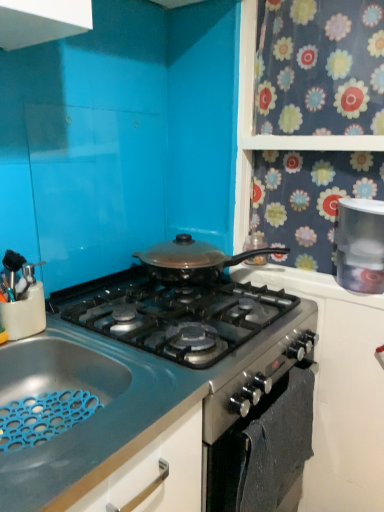
Measure the distance between point (x=285, y=455) and camera.

The distance of point (x=285, y=455) from camera is 1.17 meters.

Describe the element at coordinates (158, 398) in the screenshot. I see `satin black pan at center` at that location.

Describe the element at coordinates (360, 245) in the screenshot. I see `white plastic container at upper right` at that location.

What is the approximate height of white plastic container at upper right?

It is 10.28 inches.

At what (x,y) coordinates should I click in order to perform the action: click on satin silver oven at lower center. Please return your answer as a coordinate pair (x, y). The height and width of the screenshot is (512, 384). Looking at the image, I should click on (263, 450).

Does satin silver oven at lower center have a lesser height compared to satin black pan at center?

No.

How distant is satin silver oven at lower center from satin black pan at center?

They are 6.38 inches apart.

In the scene shown: Is satin silver oven at lower center far from satin black pan at center?

Actually, satin silver oven at lower center and satin black pan at center are a little close together.

Is satin black pan at center completely or partially inside satin silver oven at lower center?

No, satin black pan at center is located outside of satin silver oven at lower center.

From the picture: Is white plastic container at upper right at the back of blue rubber mat at lower left?

No.

Image resolution: width=384 pixels, height=512 pixels. Find the location of `sink lying in front of the white plastic container at upper right`. sink lying in front of the white plastic container at upper right is located at coordinates (74, 389).

Which is in front, point (76, 352) or point (352, 214)?

The point (76, 352) is closer.

Is blue rubber mat at lower left taller or shorter than white plastic container at upper right?

blue rubber mat at lower left is shorter than white plastic container at upper right.

Is white plastic container at upper right looking in the opposite direction of blue rubber mat at lower left?

No, white plastic container at upper right is not facing away from blue rubber mat at lower left.

How much distance is there between white plastic container at upper right and blue rubber mat at lower left?

white plastic container at upper right is 29.92 inches from blue rubber mat at lower left.

Can you confirm if white plastic container at upper right is taller than blue rubber mat at lower left?

Correct, white plastic container at upper right is much taller as blue rubber mat at lower left.

Is white plastic container at upper right inside the boundaries of blue rubber mat at lower left, or outside?

Answer: white plastic container at upper right is not inside blue rubber mat at lower left, it's outside.

From the image's perspective, would you say white plastic container at upper right is positioned over satin silver oven at lower center?

Yes, from the image's perspective, white plastic container at upper right is on top of satin silver oven at lower center.

Which object is positioned more to the right, white plastic container at upper right or satin silver oven at lower center?

Positioned to the right is white plastic container at upper right.

From a real-world perspective, who is located lower, white plastic container at upper right or satin silver oven at lower center?

From a 3D spatial view, satin silver oven at lower center is below.

Is white plastic container at upper right shorter than satin silver oven at lower center?

Indeed, white plastic container at upper right has a lesser height compared to satin silver oven at lower center.

Which is more to the right, satin black pan at center or white plastic container at upper right?

Positioned to the right is white plastic container at upper right.

Is satin black pan at center thinner than white plastic container at upper right?

No.

Where is `gas stove in front of the white plastic container at upper right`? Image resolution: width=384 pixels, height=512 pixels. gas stove in front of the white plastic container at upper right is located at coordinates (158, 398).

Measure the distance between satin black pan at center and white plastic container at upper right.

A distance of 20.87 inches exists between satin black pan at center and white plastic container at upper right.

Is satin black pan at center next to blue rubber mat at lower left and touching it?

No, satin black pan at center is not next to blue rubber mat at lower left.

Would you say satin black pan at center is to the left or to the right of blue rubber mat at lower left in the picture?

satin black pan at center is positioned on blue rubber mat at lower left's right side.

From the image's perspective, between satin black pan at center and blue rubber mat at lower left, who is located below?

blue rubber mat at lower left.

Considering the positions of objects satin black pan at center and blue rubber mat at lower left in the image provided, who is in front, satin black pan at center or blue rubber mat at lower left?

blue rubber mat at lower left.

Is blue rubber mat at lower left not within satin black pan at center?

Yes, blue rubber mat at lower left is outside of satin black pan at center.

Which object is closer to the camera taking this photo, blue rubber mat at lower left or satin black pan at center?

blue rubber mat at lower left is in front.

What's the angular difference between blue rubber mat at lower left and satin black pan at center's facing directions?

The facing directions of blue rubber mat at lower left and satin black pan at center are 0.236 degrees apart.

Is blue rubber mat at lower left far from satin black pan at center?

Actually, blue rubber mat at lower left and satin black pan at center are a little close together.

Image resolution: width=384 pixels, height=512 pixels. In order to click on oven located below the satin black pan at center (from the image's perspective) in this screenshot , I will do `click(263, 450)`.

This screenshot has height=512, width=384. Find the location of `kitchen appliance that appears above the blue rubber mat at lower left (from the image's perspective)`. kitchen appliance that appears above the blue rubber mat at lower left (from the image's perspective) is located at coordinates (360, 245).

Considering their positions, is satin silver oven at lower center positioned closer to blue rubber mat at lower left than white plastic container at upper right?

Based on the image, satin silver oven at lower center appears to be nearer to blue rubber mat at lower left.

Which object lies further to the anchor point satin silver oven at lower center, blue rubber mat at lower left or white plastic container at upper right?

The object further to satin silver oven at lower center is white plastic container at upper right.

Considering their positions, is satin black pan at center positioned further to satin silver oven at lower center than white plastic container at upper right?

The object further to satin silver oven at lower center is white plastic container at upper right.

Considering their positions, is blue rubber mat at lower left positioned closer to white plastic container at upper right than satin black pan at center?

Based on the image, satin black pan at center appears to be nearer to white plastic container at upper right.

Looking at the image, which one is located closer to satin black pan at center, satin silver oven at lower center or blue rubber mat at lower left?

Based on the image, satin silver oven at lower center appears to be nearer to satin black pan at center.

Considering their positions, is white plastic container at upper right positioned further to blue rubber mat at lower left than satin silver oven at lower center?

The object further to blue rubber mat at lower left is white plastic container at upper right.

Which object lies nearer to the anchor point satin black pan at center, white plastic container at upper right or blue rubber mat at lower left?

The object closer to satin black pan at center is blue rubber mat at lower left.

From the image, which object appears to be nearer to satin silver oven at lower center, white plastic container at upper right or blue rubber mat at lower left?

blue rubber mat at lower left is closer to satin silver oven at lower center.

The width and height of the screenshot is (384, 512). Find the location of `gas stove between blue rubber mat at lower left and white plastic container at upper right`. gas stove between blue rubber mat at lower left and white plastic container at upper right is located at coordinates (158, 398).

Locate an element on the screen. gas stove between blue rubber mat at lower left and satin silver oven at lower center is located at coordinates (158, 398).

Locate an element on the screen. This screenshot has height=512, width=384. gas stove that lies between white plastic container at upper right and satin silver oven at lower center from top to bottom is located at coordinates (158, 398).

Locate an element on the screen. This screenshot has width=384, height=512. oven between blue rubber mat at lower left and white plastic container at upper right in the horizontal direction is located at coordinates (263, 450).